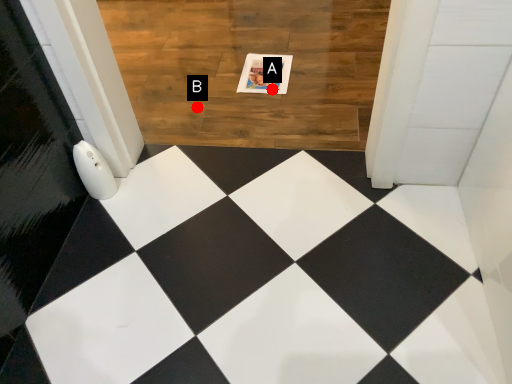
Question: Two points are circled on the image, labeled by A and B beside each circle. Which point is farther to the camera?

Choices:
 (A) A is further
 (B) B is further

Answer: (A)